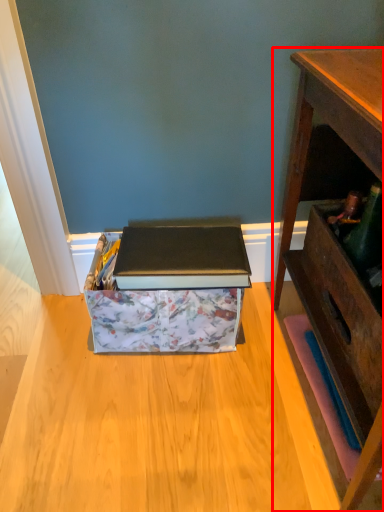
Question: From the image's perspective, considering the relative positions of desk (annotated by the red box) and cardboard box in the image provided, where is desk (annotated by the red box) located with respect to the staircase?

Choices:
 (A) below
 (B) above

Answer: (B)